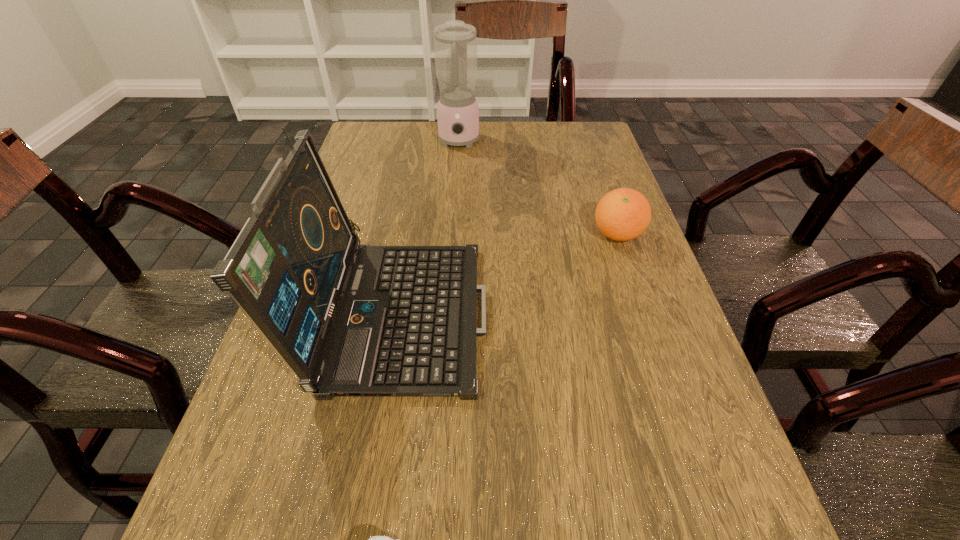
Select which object is the second closest to the nearest object. Please provide its 2D coordinates. Your answer should be formatted as a tuple, i.e. [(x, y)], where the tuple contains the x and y coordinates of a point satisfying the conditions above.

[(623, 214)]

Identify the location of object that is the second closest to the farthest object. (623, 214).

This screenshot has height=540, width=960. Identify the location of free location that satisfies the following two spatial constraints: 1. on the base of the farthest object near the control knob; 2. on the front-facing side of the laptop computer. (447, 307).

At what (x,y) coordinates should I click in order to perform the action: click on vacant space that satisfies the following two spatial constraints: 1. on the base of the food processor near the control knob; 2. on the left side of the orange. Please return your answer as a coordinate pair (x, y). Image resolution: width=960 pixels, height=540 pixels. Looking at the image, I should click on (452, 234).

The width and height of the screenshot is (960, 540). In order to click on vacant space that satisfies the following two spatial constraints: 1. on the front side of the orange; 2. on the front-facing side of the laptop computer in this screenshot , I will do `click(642, 307)`.